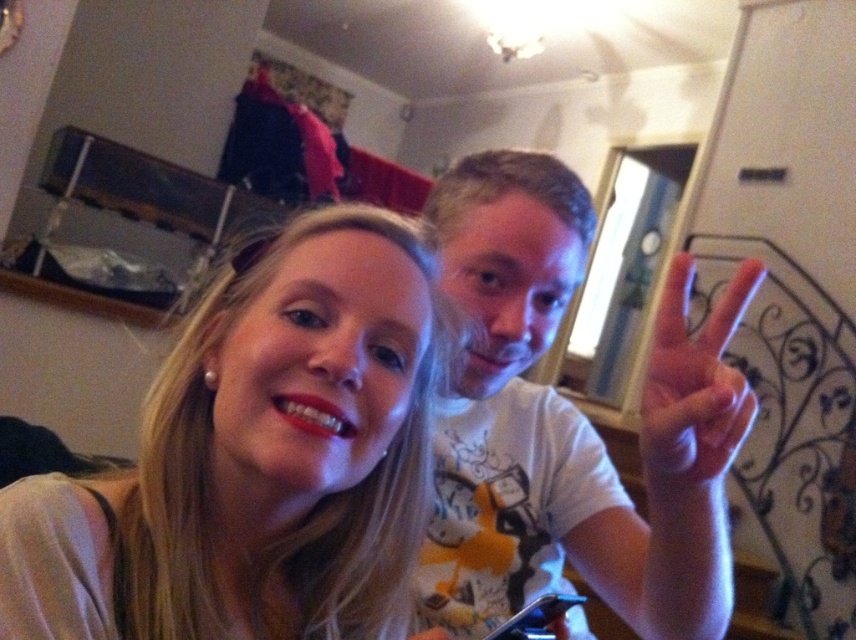
Question: Is smooth beige shirt at center in front of white matte t-shirt at center?

Choices:
 (A) yes
 (B) no

Answer: (A)

Question: Which object is positioned closest to the white matte t-shirt at center?

Choices:
 (A) pink matte hand at center right
 (B) smooth beige shirt at center

Answer: (A)

Question: Which of these objects is positioned farthest from the white matte t-shirt at center?

Choices:
 (A) pink matte hand at center right
 (B) smooth beige shirt at center

Answer: (B)

Question: Does smooth beige shirt at center have a smaller size compared to pink matte hand at center right?

Choices:
 (A) no
 (B) yes

Answer: (A)

Question: Among these objects, which one is nearest to the camera?

Choices:
 (A) white matte t-shirt at center
 (B) smooth beige shirt at center

Answer: (B)

Question: Can you confirm if smooth beige shirt at center is positioned to the right of pink matte hand at center right?

Choices:
 (A) yes
 (B) no

Answer: (B)